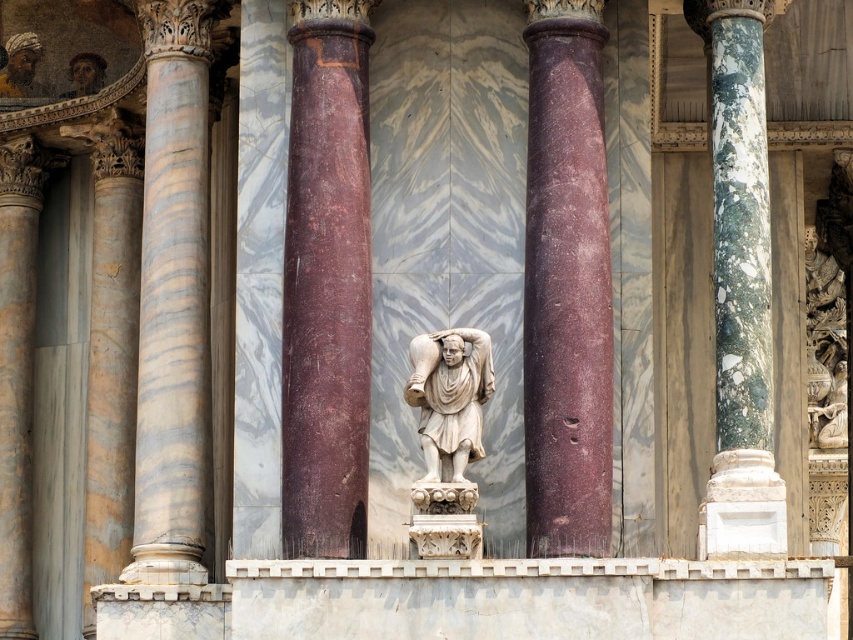
You are an architect examining the structure. You notice a specific point at coordinates [741,294]. Which column is this point located on?

The point at coordinates [741,294] is on the green marble column at right.

You are an architect examining the structure and need to determine which column is wider. Based on the scene, which column has a greater width between the marble column at left and the green marble column at right?

The marble column at left has a greater width than the green marble column at right as stated in the description.